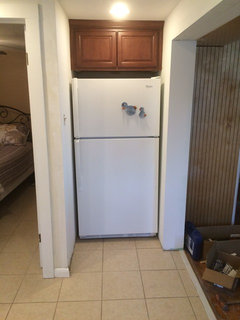
You are a GUI agent. You are given a task and a screenshot of the screen. Output one action in this format:
    pyautogui.click(x=<x>, y=<y>)
    Task: Click on the baseboard
    The image size is (240, 320).
    Given the screenshot: What is the action you would take?
    pyautogui.click(x=64, y=272)